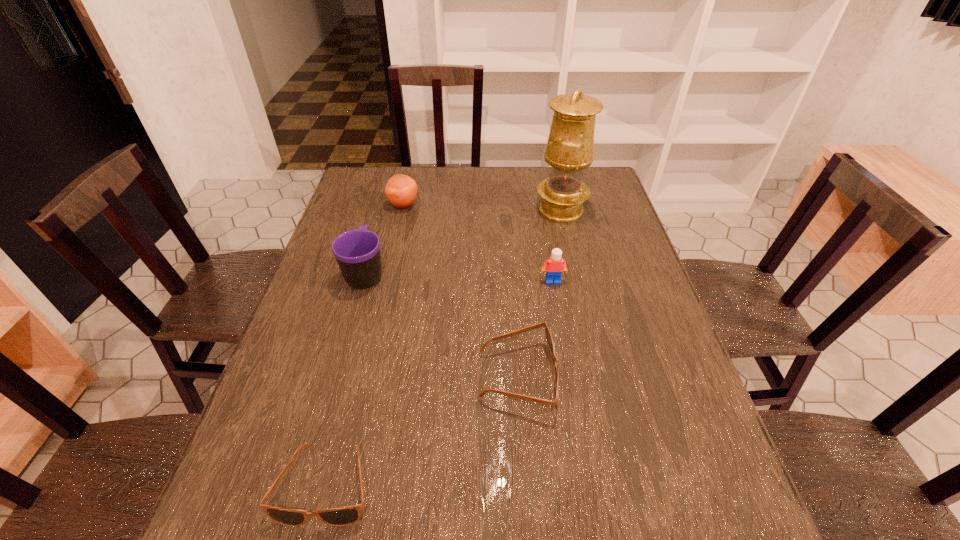
The image size is (960, 540). Identify the location of vacant space that is in between the orange and the tallest object. (482, 207).

You are a GUI agent. You are given a task and a screenshot of the screen. Output one action in this format:
    pyautogui.click(x=<x>, y=<y>)
    Task: Click on the vacant space that is in between the orange and the mug
    The width and height of the screenshot is (960, 540).
    Given the screenshot: What is the action you would take?
    pyautogui.click(x=384, y=239)

Locate an element on the screen. This screenshot has width=960, height=540. free space between the farther sunglasses and the mug is located at coordinates (442, 325).

Where is `unoccupied area between the second nearest object and the orange`? This screenshot has width=960, height=540. unoccupied area between the second nearest object and the orange is located at coordinates (461, 291).

Where is `empty space between the Lego and the left sunglasses`? The height and width of the screenshot is (540, 960). empty space between the Lego and the left sunglasses is located at coordinates (440, 383).

You are a GUI agent. You are given a task and a screenshot of the screen. Output one action in this format:
    pyautogui.click(x=<x>, y=<y>)
    Task: Click on the free space between the nearer sunglasses and the mug
    This screenshot has height=540, width=960.
    Given the screenshot: What is the action you would take?
    pyautogui.click(x=347, y=379)

At what (x,y) coordinates should I click in order to perform the action: click on the third closest object relative to the right sunglasses. Please return your answer as a coordinate pair (x, y). This screenshot has width=960, height=540. Looking at the image, I should click on (357, 252).

Where is `object that ranks as the third closest to the fifth farthest object`? Image resolution: width=960 pixels, height=540 pixels. object that ranks as the third closest to the fifth farthest object is located at coordinates (357, 252).